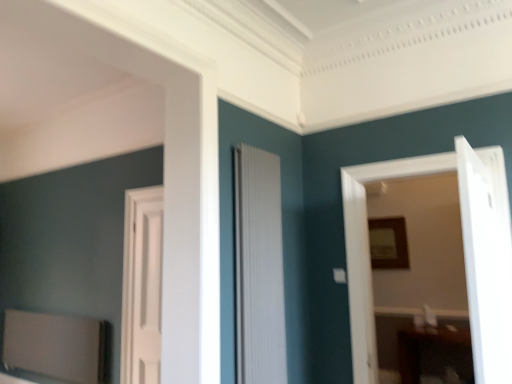
Question: Can you confirm if white ribbed radiator at center, the 2th door when ordered from left to right, is wider than white matte door at center, the 4th door positioned from the right?

Choices:
 (A) no
 (B) yes

Answer: (A)

Question: Is white ribbed radiator at center, the 2th door when ordered from left to right, shorter than white matte door at center, the first door in the left-to-right sequence?

Choices:
 (A) no
 (B) yes

Answer: (B)

Question: From the image's perspective, does white ribbed radiator at center, arranged as the 3th door when viewed from the right, appear lower than white matte door at center, the first door in the left-to-right sequence?

Choices:
 (A) no
 (B) yes

Answer: (A)

Question: Is white ribbed radiator at center, arranged as the 3th door when viewed from the right, closer to camera compared to white matte door at center, the 4th door positioned from the right?

Choices:
 (A) yes
 (B) no

Answer: (A)

Question: Is white ribbed radiator at center, arranged as the 3th door when viewed from the right, not near white matte door at center, the first door in the left-to-right sequence?

Choices:
 (A) no
 (B) yes

Answer: (B)

Question: From a real-world perspective, is white ribbed radiator at center, arranged as the 3th door when viewed from the right, located beneath white matte door at center, the 4th door positioned from the right?

Choices:
 (A) yes
 (B) no

Answer: (B)

Question: Can you confirm if white wooden door at center, which is counted as the second door, starting from the right, is positioned to the right of wooden frame at upper right?

Choices:
 (A) no
 (B) yes

Answer: (A)

Question: From the image's perspective, does white wooden door at center, which is counted as the second door, starting from the right, appear higher than wooden frame at upper right?

Choices:
 (A) yes
 (B) no

Answer: (A)

Question: Could you tell me if white wooden door at center, which is the 3th door in left-to-right order, is turned towards wooden frame at upper right?

Choices:
 (A) yes
 (B) no

Answer: (B)

Question: Is white wooden door at center, which is counted as the second door, starting from the right, bigger than wooden frame at upper right?

Choices:
 (A) yes
 (B) no

Answer: (A)

Question: From the image's perspective, is white wooden door at center, which is the 3th door in left-to-right order, under wooden frame at upper right?

Choices:
 (A) yes
 (B) no

Answer: (B)

Question: Is white wooden door at center, which is the 3th door in left-to-right order, outside of wooden frame at upper right?

Choices:
 (A) yes
 (B) no

Answer: (A)

Question: Can white matte door at center, the first door in the left-to-right sequence, be found inside white glossy door at right, marked as the first door in a right-to-left arrangement?

Choices:
 (A) no
 (B) yes

Answer: (A)